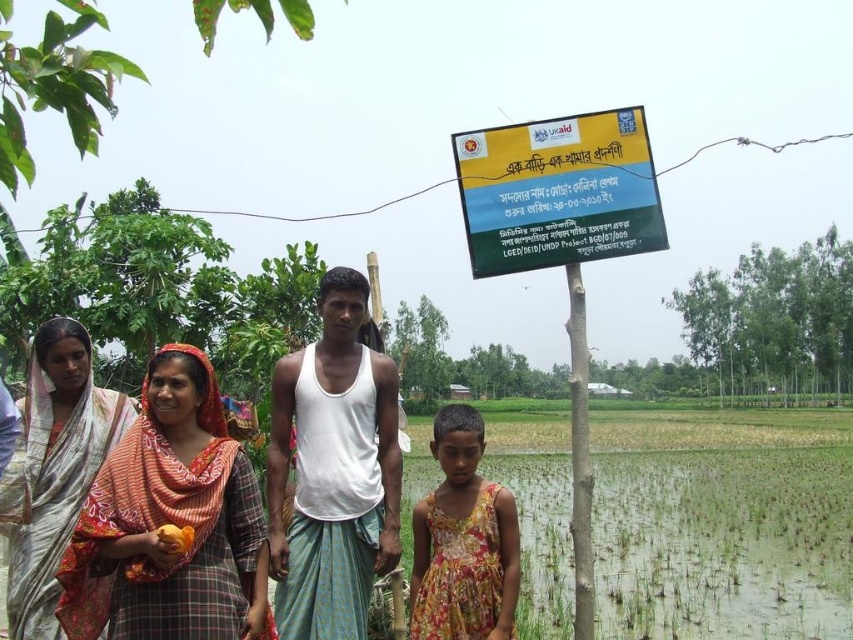
Question: Does white cotton tank top at center lie in front of floral fabric dress at center?

Choices:
 (A) no
 (B) yes

Answer: (A)

Question: Which point is closer to the camera taking this photo?

Choices:
 (A) (61, 440)
 (B) (236, 480)
 (C) (498, 563)
 (D) (467, 243)

Answer: (B)

Question: Does orange plaid dress at center have a greater width compared to floral fabric dress at center?

Choices:
 (A) no
 (B) yes

Answer: (B)

Question: Is orange plaid dress at center below silky silver saree at left?

Choices:
 (A) no
 (B) yes

Answer: (A)

Question: Considering the real-world distances, which object is farthest from the silky silver saree at left?

Choices:
 (A) white cotton tank top at center
 (B) white cotton saree at center
 (C) floral fabric dress at center

Answer: (C)

Question: Among these points, which one is nearest to the camera?

Choices:
 (A) (495, 573)
 (B) (39, 563)
 (C) (372, 518)

Answer: (A)